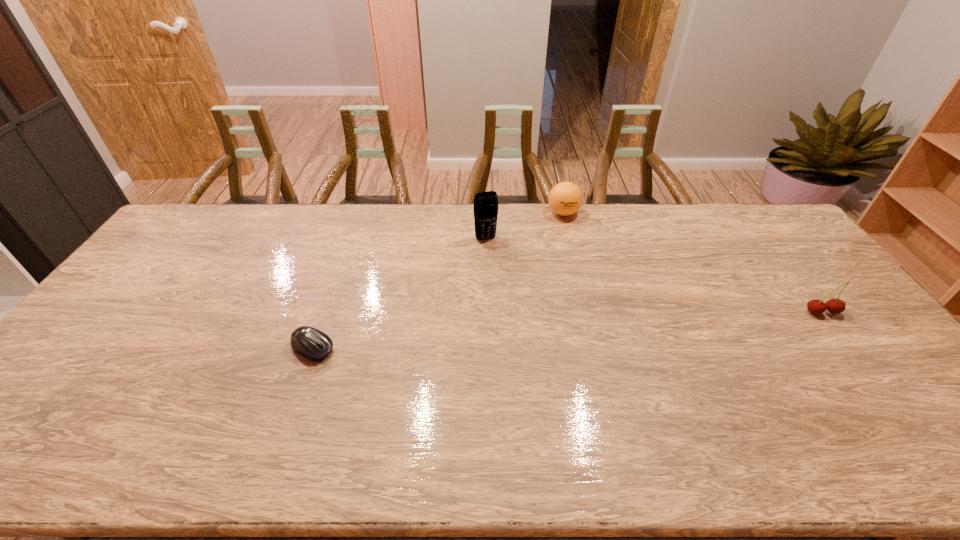
At what (x,y) coordinates should I click in order to perform the action: click on free point located on the side with brand of the farthest object. Please return your answer as a coordinate pair (x, y). Looking at the image, I should click on (542, 289).

Identify the location of vacant space situated on the side with brand of the farthest object. This screenshot has height=540, width=960. (550, 260).

Find the location of a particular element. free space located 0.060m on the side with brand of the farthest object is located at coordinates (558, 232).

Locate an element on the screen. The width and height of the screenshot is (960, 540). vacant point located on the screen of the cellular telephone is located at coordinates (506, 284).

Locate an element on the screen. free space located 0.110m on the screen of the cellular telephone is located at coordinates (497, 263).

I want to click on free space located 0.350m on the screen of the cellular telephone, so click(x=519, y=316).

You are a GUI agent. You are given a task and a screenshot of the screen. Output one action in this format:
    pyautogui.click(x=<x>, y=<y>)
    Task: Click on the ping-pong ball at the far edge
    
    Given the screenshot: What is the action you would take?
    pyautogui.click(x=565, y=198)

Locate an element on the screen. cellular telephone at the far edge is located at coordinates (485, 203).

The height and width of the screenshot is (540, 960). Identify the location of object present at the right edge. (835, 306).

At what (x,y) coordinates should I click in order to perform the action: click on vacant space at the far edge of the desktop. Please return your answer as a coordinate pair (x, y). The image size is (960, 540). Looking at the image, I should click on (403, 208).